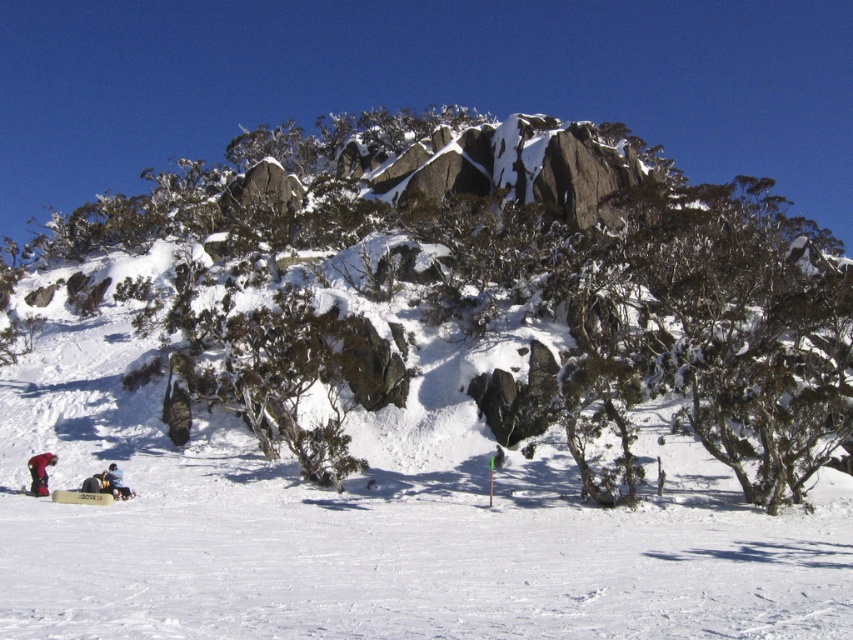
Which is below, green leafy shrub at center or white snowboarder at lower left?

Positioned lower is white snowboarder at lower left.

Is green leafy shrub at center in front of white snowboarder at lower left?

No, it is behind white snowboarder at lower left.

Locate an element on the screen. This screenshot has height=640, width=853. green leafy shrub at center is located at coordinates (480, 296).

Where is `green leafy shrub at center`? The height and width of the screenshot is (640, 853). green leafy shrub at center is located at coordinates (480, 296).

From the picture: Is the position of red fabric jacket at lower left more distant than that of white snowboarder at lower left?

That is True.

Does red fabric jacket at lower left have a larger size compared to white snowboarder at lower left?

Incorrect, red fabric jacket at lower left is not larger than white snowboarder at lower left.

Does point (55, 458) come behind point (111, 477)?

That is True.

This screenshot has width=853, height=640. I want to click on red fabric jacket at lower left, so click(39, 472).

Is green leafy shrub at center taller than red fabric jacket at lower left?

Yes, green leafy shrub at center is taller than red fabric jacket at lower left.

Which is behind, point (474, 182) or point (38, 481)?

Point (474, 182)

Locate an element on the screen. The height and width of the screenshot is (640, 853). green leafy shrub at center is located at coordinates (480, 296).